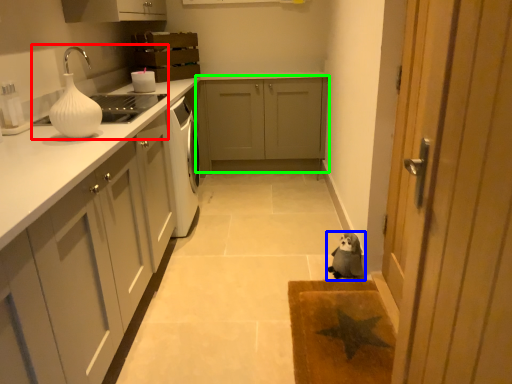
Question: Estimate the real-world distances between objects in this image. Which object is closer to sink (highlighted by a red box), dog (highlighted by a blue box) or cabinetry (highlighted by a green box)?

Choices:
 (A) dog
 (B) cabinetry

Answer: (B)